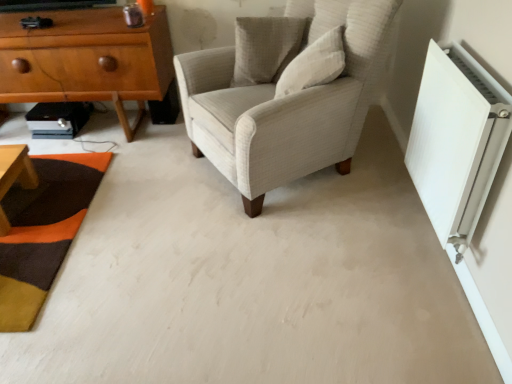
Question: Does textured beige pillow at upper center, the 2th pillow positioned from the front, have a smaller size compared to light beige fabric armchair at center?

Choices:
 (A) yes
 (B) no

Answer: (A)

Question: Is textured beige pillow at upper center, the 2th pillow positioned from the front, located outside light beige fabric armchair at center?

Choices:
 (A) no
 (B) yes

Answer: (A)

Question: Can you see textured beige pillow at upper center, the 2th pillow positioned from the front, touching light beige fabric armchair at center?

Choices:
 (A) no
 (B) yes

Answer: (A)

Question: From a real-world perspective, is textured beige pillow at upper center, the 2th pillow positioned from the front, positioned over light beige fabric armchair at center based on gravity?

Choices:
 (A) no
 (B) yes

Answer: (B)

Question: From a real-world perspective, does textured beige pillow at upper center, positioned as the first pillow in back-to-front order, sit lower than light beige fabric armchair at center?

Choices:
 (A) no
 (B) yes

Answer: (A)

Question: From a real-world perspective, relative to textured beige pillow at upper center, positioned as the first pillow in back-to-front order, is white plastic radiator at right vertically above or below?

Choices:
 (A) above
 (B) below

Answer: (B)

Question: Would you say white plastic radiator at right is inside or outside textured beige pillow at upper center, positioned as the first pillow in back-to-front order?

Choices:
 (A) outside
 (B) inside

Answer: (A)

Question: In terms of size, does white plastic radiator at right appear bigger or smaller than textured beige pillow at upper center, positioned as the first pillow in back-to-front order?

Choices:
 (A) small
 (B) big

Answer: (B)

Question: Visually, is white plastic radiator at right positioned to the left or to the right of textured beige pillow at upper center, positioned as the first pillow in back-to-front order?

Choices:
 (A) left
 (B) right

Answer: (B)

Question: Looking at the image, does textured wool mat at lower left seem bigger or smaller compared to white plastic radiator at right?

Choices:
 (A) small
 (B) big

Answer: (A)

Question: Relative to white plastic radiator at right, is textured wool mat at lower left in front or behind?

Choices:
 (A) behind
 (B) front

Answer: (A)

Question: Based on their positions, is textured wool mat at lower left located to the left or right of white plastic radiator at right?

Choices:
 (A) right
 (B) left

Answer: (B)

Question: In terms of width, does textured wool mat at lower left look wider or thinner when compared to white plastic radiator at right?

Choices:
 (A) wide
 (B) thin

Answer: (A)

Question: Looking at the image, does light brown wood chest of drawers at left seem bigger or smaller compared to white plastic radiator at right?

Choices:
 (A) small
 (B) big

Answer: (B)

Question: Relative to white plastic radiator at right, is light brown wood chest of drawers at left in front or behind?

Choices:
 (A) front
 (B) behind

Answer: (B)